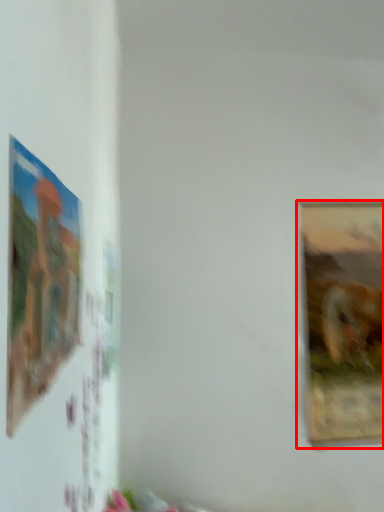
Question: From the image's perspective, where is picture frame (annotated by the red box) located in relation to picture frame in the image?

Choices:
 (A) below
 (B) above

Answer: (A)